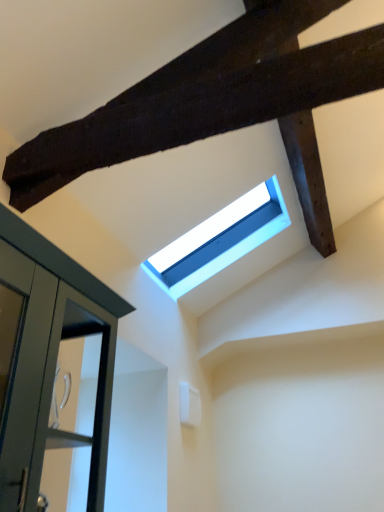
What is the approximate height of transparent glass window at upper center?

19.84 inches.

This screenshot has width=384, height=512. Describe the element at coordinates (218, 241) in the screenshot. I see `transparent glass window at upper center` at that location.

Where is `transparent glass window at upper center`? transparent glass window at upper center is located at coordinates (218, 241).

This screenshot has width=384, height=512. What are the coordinates of `transparent glass window at upper center` in the screenshot? It's located at (218, 241).